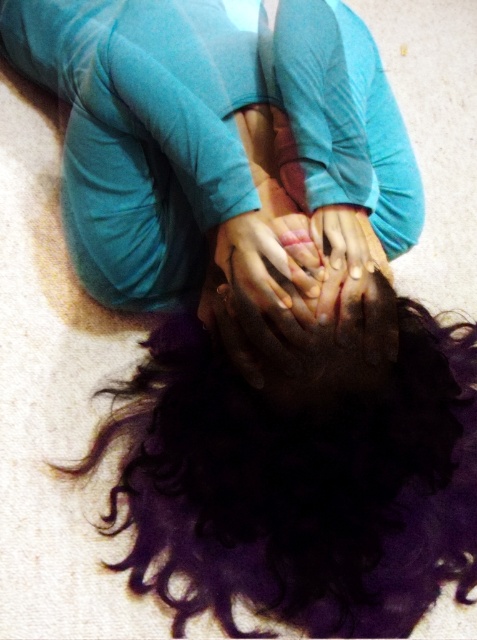
Question: Is dark curly hair at center bigger than smooth skin hands at center?

Choices:
 (A) yes
 (B) no

Answer: (A)

Question: Which point is farther to the camera?

Choices:
 (A) smooth skin hands at center
 (B) dark curly hair at center

Answer: (A)

Question: Which point is farther from the camera taking this photo?

Choices:
 (A) (277, 266)
 (B) (169, 348)

Answer: (B)

Question: Does dark curly hair at center come in front of smooth skin hands at center?

Choices:
 (A) yes
 (B) no

Answer: (A)

Question: Can you confirm if dark curly hair at center is bigger than smooth skin hands at center?

Choices:
 (A) no
 (B) yes

Answer: (B)